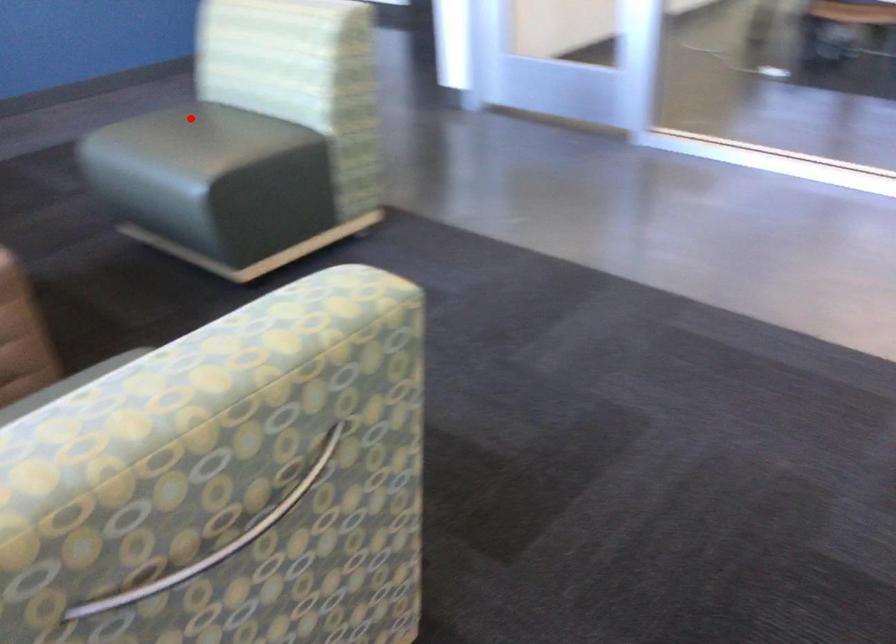
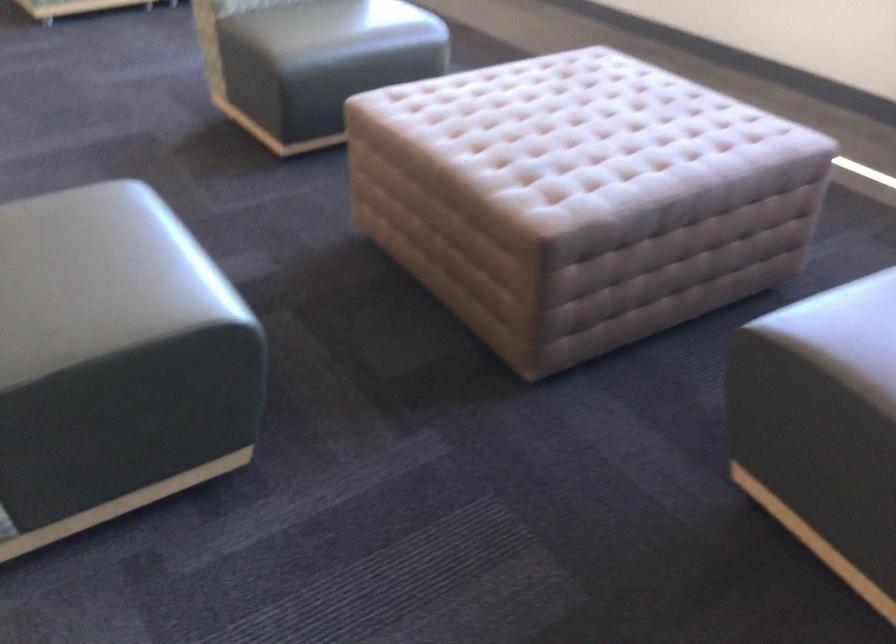
In the second image, find the point that corresponds to the highlighted location in the first image.

(99, 278)